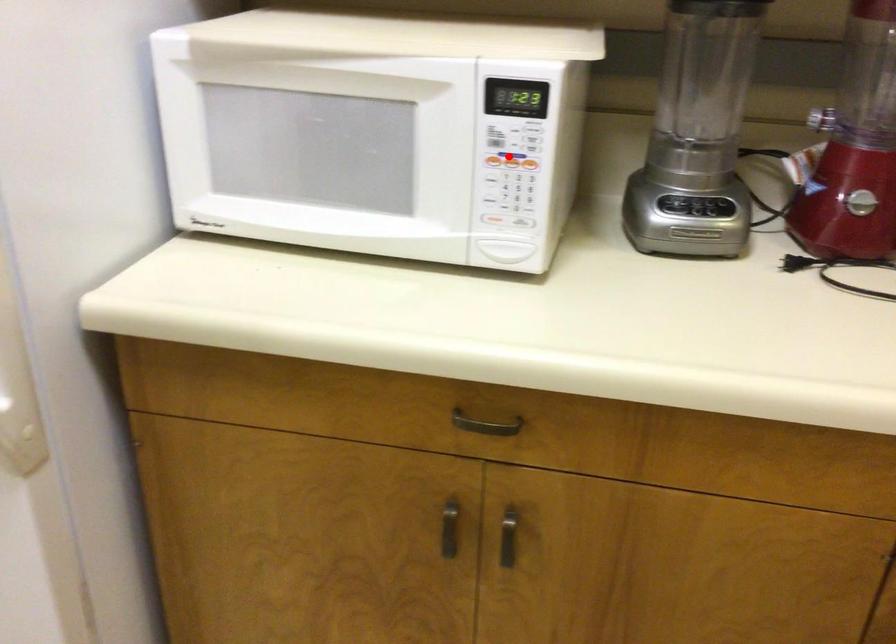
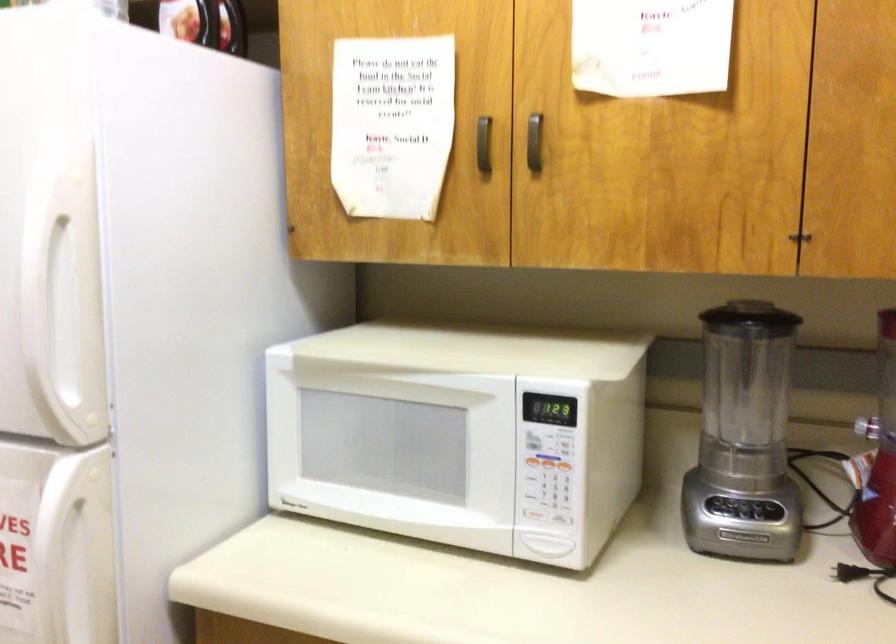
The point at the highlighted location is marked in the first image. Where is the corresponding point in the second image?

(547, 462)